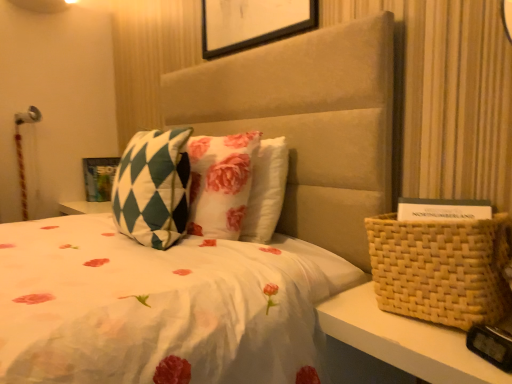
Image resolution: width=512 pixels, height=384 pixels. Find the location of `matte green and white checkered picture frame at upper left`. matte green and white checkered picture frame at upper left is located at coordinates (99, 177).

Locate an element on the screen. woven beige basket at right is located at coordinates (442, 269).

Image resolution: width=512 pixels, height=384 pixels. What are the coordinates of `green checkered pillow at center` in the screenshot? It's located at (153, 188).

Looking at this image, is green checkered pillow at center inside or outside of matte green and white checkered picture frame at upper left?

green checkered pillow at center exists outside the volume of matte green and white checkered picture frame at upper left.

Is green checkered pillow at center oriented towards matte green and white checkered picture frame at upper left?

No, green checkered pillow at center is not oriented towards matte green and white checkered picture frame at upper left.

From the image's perspective, which one is positioned higher, green checkered pillow at center or matte green and white checkered picture frame at upper left?

matte green and white checkered picture frame at upper left is shown above in the image.

Measure the distance from woven beige basket at right to green checkered pillow at center.

woven beige basket at right is 75.24 centimeters away from green checkered pillow at center.

Is woven beige basket at right bigger or smaller than green checkered pillow at center?

woven beige basket at right is smaller than green checkered pillow at center.

Is woven beige basket at right positioned in front of green checkered pillow at center?

Yes, woven beige basket at right is closer to the viewer.

Is there a large distance between woven beige basket at right and green checkered pillow at center?

No, woven beige basket at right is in close proximity to green checkered pillow at center.

Considering the relative positions of matte green and white checkered picture frame at upper left and green checkered pillow at center in the image provided, is matte green and white checkered picture frame at upper left to the left or to the right of green checkered pillow at center?

In the image, matte green and white checkered picture frame at upper left appears on the left side of green checkered pillow at center.

Is matte green and white checkered picture frame at upper left inside or outside of green checkered pillow at center?

matte green and white checkered picture frame at upper left exists outside the volume of green checkered pillow at center.

From a real-world perspective, is matte green and white checkered picture frame at upper left above or below green checkered pillow at center?

In terms of real-world spatial position, matte green and white checkered picture frame at upper left is below green checkered pillow at center.

Between matte green and white checkered picture frame at upper left and green checkered pillow at center, which one has larger size?

Bigger between the two is green checkered pillow at center.

Consider the image. From a real-world perspective, between matte green and white checkered picture frame at upper left and woven beige basket at right, who is vertically higher?

In real-world perspective, matte green and white checkered picture frame at upper left is above.

From the image's perspective, is matte green and white checkered picture frame at upper left located beneath woven beige basket at right?

No, from the image's perspective, matte green and white checkered picture frame at upper left is not below woven beige basket at right.

Who is more distant, matte green and white checkered picture frame at upper left or woven beige basket at right?

matte green and white checkered picture frame at upper left is behind.

Does matte green and white checkered picture frame at upper left have a greater width compared to woven beige basket at right?

No.

Based on the photo, measure the distance between woven beige basket at right and matte green and white checkered picture frame at upper left.

woven beige basket at right and matte green and white checkered picture frame at upper left are 7.43 feet apart.

In order to click on picture frame above the woven beige basket at right (from the image's perspective) in this screenshot , I will do `click(99, 177)`.

Consider the image. From a real-world perspective, is woven beige basket at right below matte green and white checkered picture frame at upper left?

Yes, from a real-world perspective, woven beige basket at right is below matte green and white checkered picture frame at upper left.

Is woven beige basket at right inside the boundaries of matte green and white checkered picture frame at upper left, or outside?

woven beige basket at right is spatially situated outside matte green and white checkered picture frame at upper left.

From the image's perspective, is green checkered pillow at center on woven beige basket at right?

Yes, from the image's perspective, green checkered pillow at center is over woven beige basket at right.

Is green checkered pillow at center positioned with its back to woven beige basket at right?

green checkered pillow at center is not turned away from woven beige basket at right.

In the scene shown: Which is closer to the camera, (156, 170) or (390, 291)?

Point (156, 170) is positioned farther from the camera compared to point (390, 291).

From a real-world perspective, is green checkered pillow at center above or below woven beige basket at right?

green checkered pillow at center is situated higher than woven beige basket at right in the real world.

You are a GUI agent. You are given a task and a screenshot of the screen. Output one action in this format:
    pyautogui.click(x=<x>, y=<y>)
    Task: Click on the picture frame below the green checkered pillow at center (from a real-world perspective)
    The width and height of the screenshot is (512, 384).
    Given the screenshot: What is the action you would take?
    pyautogui.click(x=99, y=177)

Image resolution: width=512 pixels, height=384 pixels. In order to click on pillow lying on the left of woven beige basket at right in this screenshot , I will do `click(153, 188)`.

Estimate the real-world distances between objects in this image. Which object is closer to woven beige basket at right, green checkered pillow at center or matte green and white checkered picture frame at upper left?

Among the two, green checkered pillow at center is located nearer to woven beige basket at right.

Based on their spatial positions, is green checkered pillow at center or woven beige basket at right further from matte green and white checkered picture frame at upper left?

woven beige basket at right is further to matte green and white checkered picture frame at upper left.

Considering their positions, is woven beige basket at right positioned closer to green checkered pillow at center than matte green and white checkered picture frame at upper left?

woven beige basket at right is positioned closer to the anchor green checkered pillow at center.

When comparing their distances from matte green and white checkered picture frame at upper left, does woven beige basket at right or green checkered pillow at center seem closer?

The object closer to matte green and white checkered picture frame at upper left is green checkered pillow at center.

From the image, which object appears to be farther from green checkered pillow at center, matte green and white checkered picture frame at upper left or woven beige basket at right?

Among the two, matte green and white checkered picture frame at upper left is located further to green checkered pillow at center.

Considering their positions, is matte green and white checkered picture frame at upper left positioned further to woven beige basket at right than green checkered pillow at center?

The object further to woven beige basket at right is matte green and white checkered picture frame at upper left.

Image resolution: width=512 pixels, height=384 pixels. In order to click on pillow between woven beige basket at right and matte green and white checkered picture frame at upper left in the front-back direction in this screenshot , I will do `click(153, 188)`.